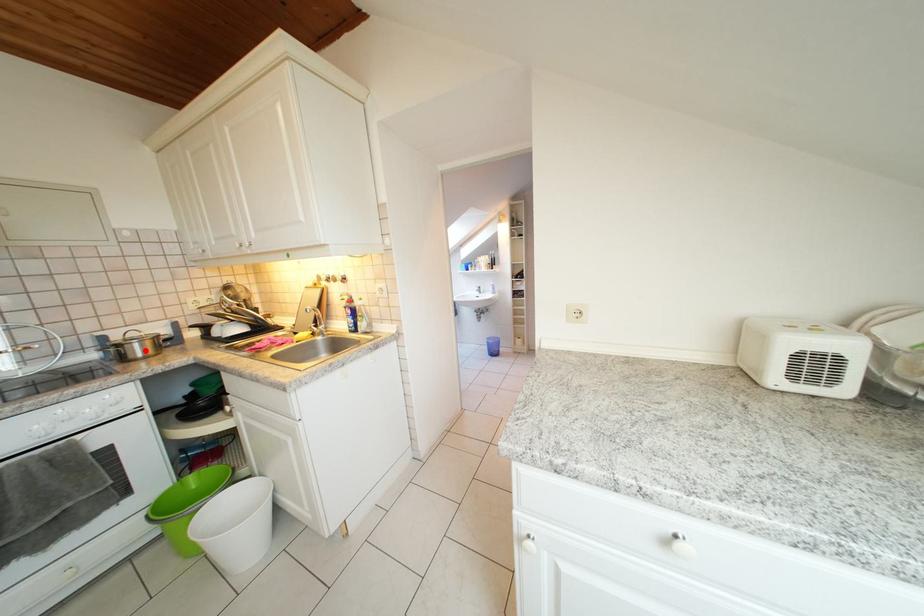
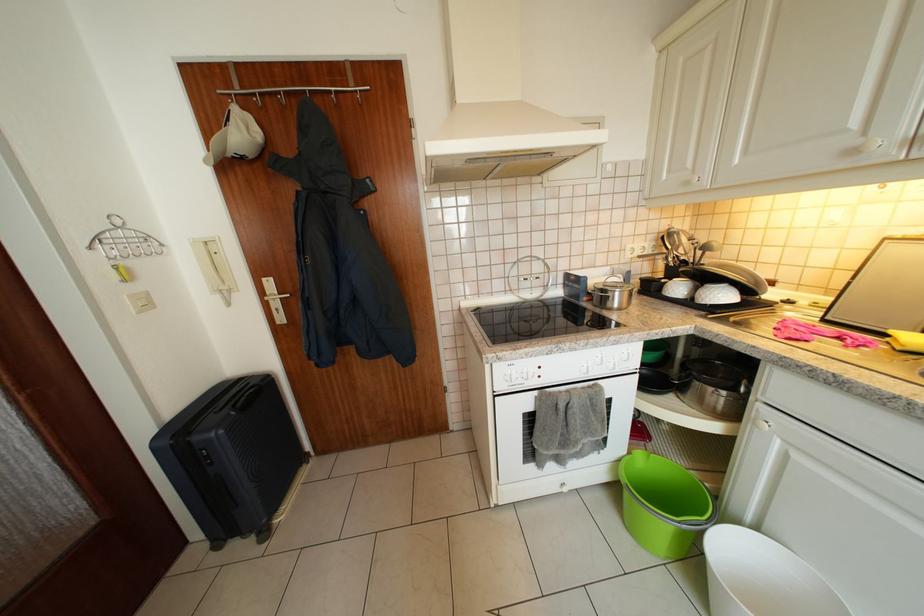
Where in the second image is the point corresponding to the highlighted location from the first image?

(626, 299)